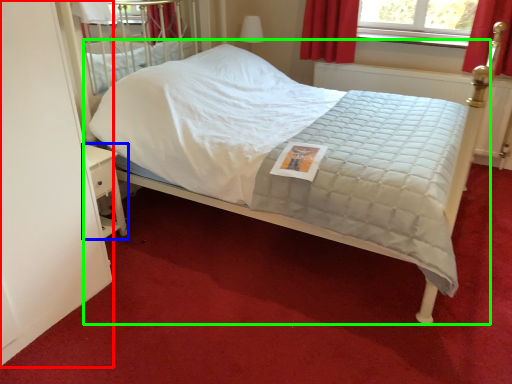
Question: Which is nearer to the screen door (highlighted by a red box)? nightstand (highlighted by a blue box) or bed (highlighted by a green box).

Choices:
 (A) nightstand
 (B) bed

Answer: (A)